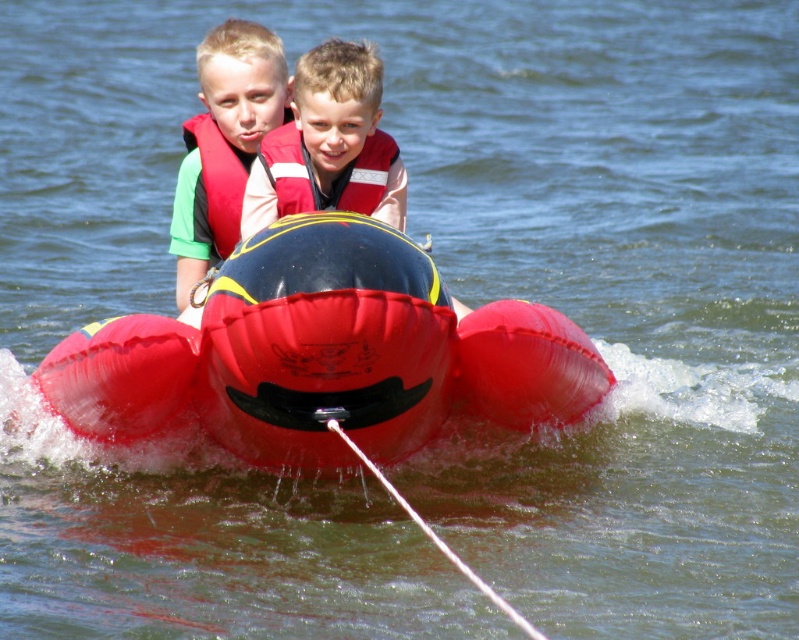
You are a photographer trying to capture a closeup of the boy on the left. You have two focus points available at coordinates point (366, 88) and point (257, 120). Which point should you choose to ensure the boy on the left is in focus?

Point (366, 88) is closer to the viewer than point (257, 120), so you should choose point (366, 88) to focus on the boy on the left.

You are a lifeguard on duty and need to reach the nearest life jacket to save someone. You are standing at the center of the scene. Which life jacket should you grab first, the matte red life vest at center or the red nylon life jacket at upper center?

The matte red life vest at center is located at the center of the scene, so it is closer to you than the red nylon life jacket at upper center which is 3.06 meters away. You should grab the matte red life vest at center first.